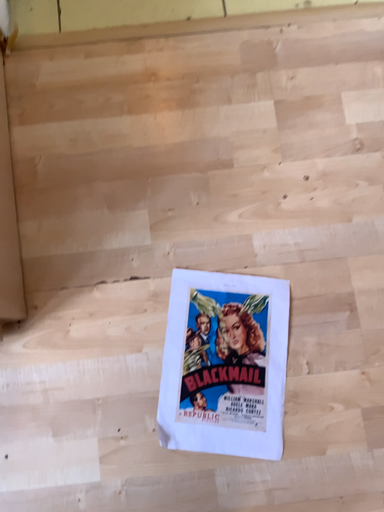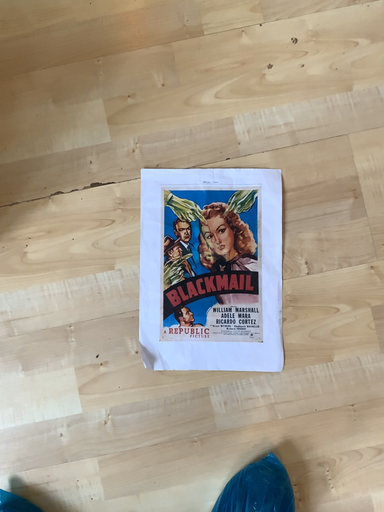
Question: How did the camera likely rotate when shooting the video?

Choices:
 (A) rotated upward
 (B) rotated downward

Answer: (B)